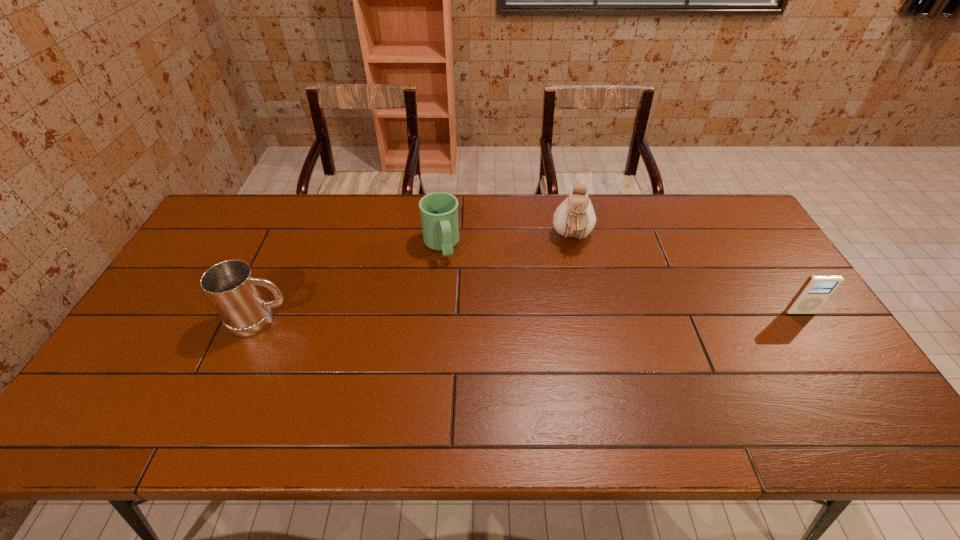
The width and height of the screenshot is (960, 540). I want to click on vacant space at the far left corner, so click(x=250, y=201).

The width and height of the screenshot is (960, 540). What are the coordinates of `vacant space at the far right corner of the desktop` in the screenshot? It's located at (727, 194).

Locate an element on the screen. empty space that is in between the nearer mug and the iPod is located at coordinates (531, 316).

Find the location of `vacant area between the nearer mug and the right mug`. vacant area between the nearer mug and the right mug is located at coordinates (351, 282).

Where is `empty location between the rightmost object and the pouch`? empty location between the rightmost object and the pouch is located at coordinates (686, 275).

The image size is (960, 540). What are the coordinates of `vacant area that lies between the right mug and the leftmost object` in the screenshot? It's located at (351, 282).

The image size is (960, 540). In order to click on empty space between the pouch and the left mug in this screenshot , I will do `click(417, 279)`.

Image resolution: width=960 pixels, height=540 pixels. What are the coordinates of `empty location between the rightmost object and the right mug` in the screenshot? It's located at (620, 279).

Identify the location of vacant space that is in between the pouch and the nearer mug. (417, 279).

Identify the location of vacant area that lies between the rightmost object and the pouch. The width and height of the screenshot is (960, 540). (686, 275).